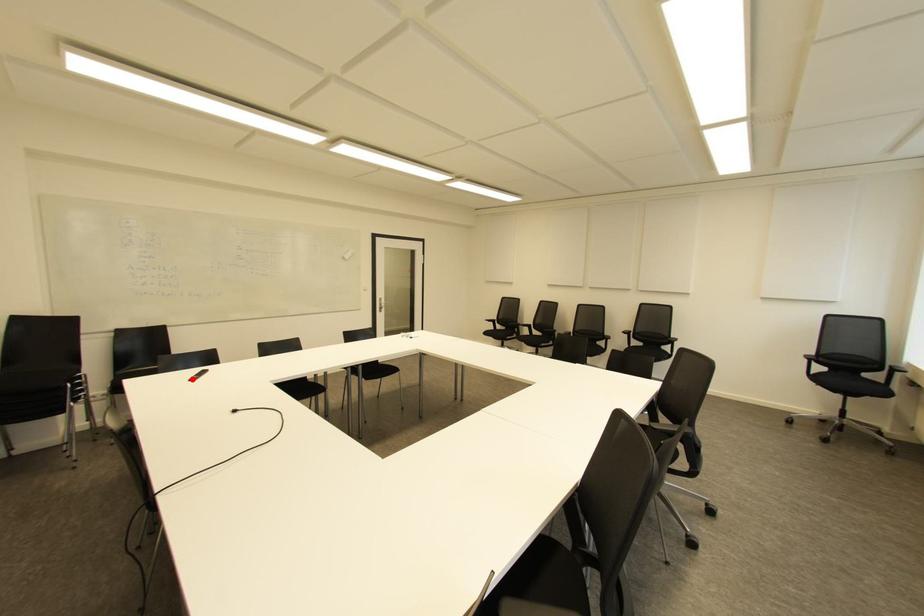
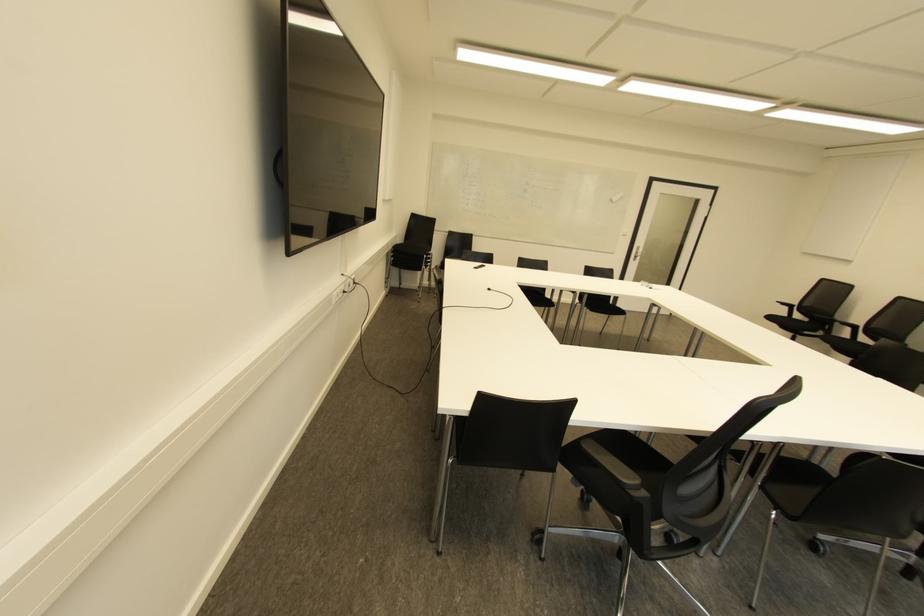
Question: I am providing you with two images of the same scene from different viewpoints. A red point is marked on the first image. Is the red point's position out of view in image 2?

Choices:
 (A) Yes
 (B) No

Answer: (B)